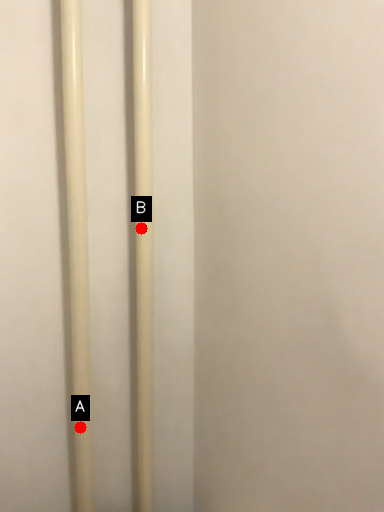
Question: Two points are circled on the image, labeled by A and B beside each circle. Among these points, which one is nearest to the camera?

Choices:
 (A) A is closer
 (B) B is closer

Answer: (B)